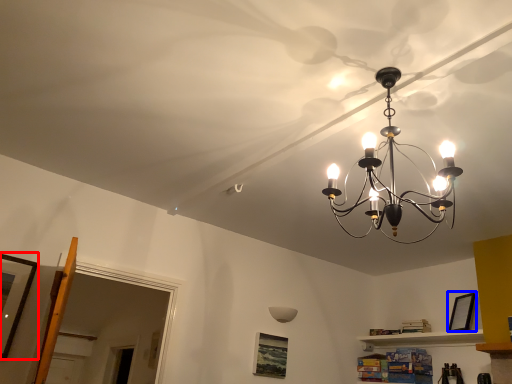
Question: Which object is closer to the camera taking this photo, picture frame (highlighted by a red box) or picture frame (highlighted by a blue box)?

Choices:
 (A) picture frame
 (B) picture frame

Answer: (A)